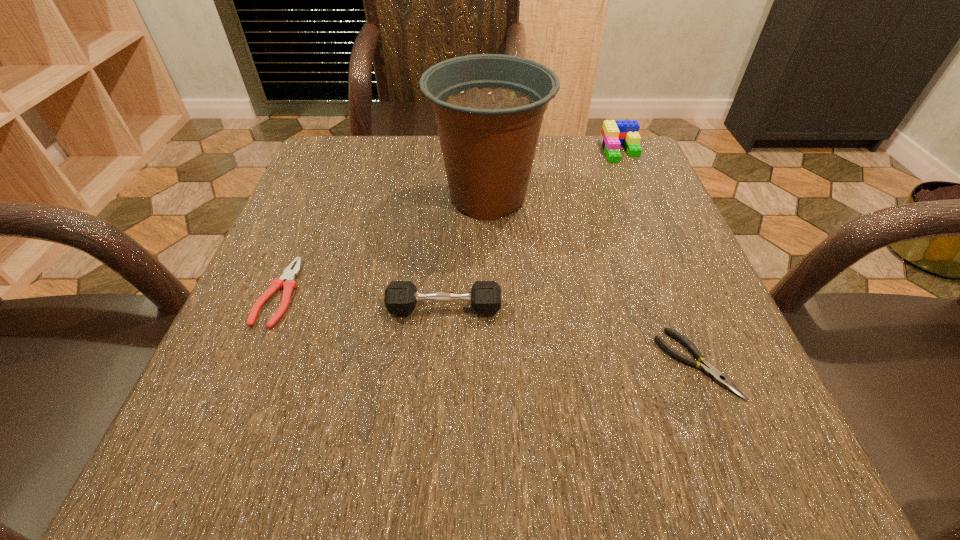
Identify the location of the tallest object. (489, 108).

Locate an element on the screen. This screenshot has width=960, height=540. flowerpot is located at coordinates (489, 108).

Locate an element on the screen. The image size is (960, 540). the farthest object is located at coordinates (614, 133).

This screenshot has width=960, height=540. Identify the location of dumbbell. (401, 297).

At what (x,y) coordinates should I click in order to perform the action: click on the farther pliers. Please return your answer as a coordinate pair (x, y). This screenshot has height=540, width=960. Looking at the image, I should click on (287, 281).

Identify the location of the leftmost object. This screenshot has width=960, height=540. (287, 281).

Identify the location of the nearest object. (709, 370).

Where is `the right pliers`? the right pliers is located at coordinates (709, 370).

Where is `blank space located on the front of the flowerpot`? blank space located on the front of the flowerpot is located at coordinates (489, 268).

I want to click on free space located 0.360m on the left of the Lego, so click(452, 151).